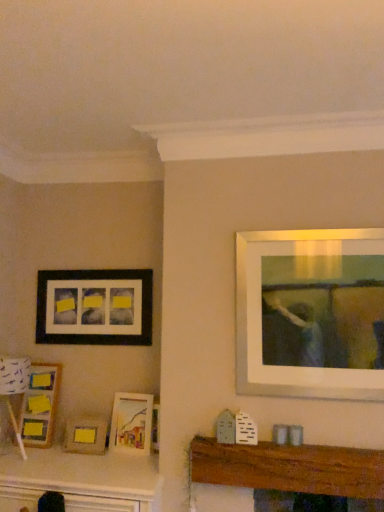
Question: From a real-world perspective, is white paper lampshade at lower left located higher than matte black picture frame at left, placed as the fourth picture frame when sorted from bottom to top?

Choices:
 (A) no
 (B) yes

Answer: (A)

Question: From the image's perspective, is white paper lampshade at lower left located beneath matte black picture frame at left, which appears as the first picture frame when viewed from the top?

Choices:
 (A) yes
 (B) no

Answer: (A)

Question: Would you say white paper lampshade at lower left is a long distance from matte black picture frame at left, placed as the fourth picture frame when sorted from bottom to top?

Choices:
 (A) no
 (B) yes

Answer: (A)

Question: Is white paper lampshade at lower left thinner than matte black picture frame at left, which appears as the first picture frame when viewed from the top?

Choices:
 (A) no
 (B) yes

Answer: (A)

Question: From a real-world perspective, does white paper lampshade at lower left sit lower than matte black picture frame at left, placed as the fourth picture frame when sorted from bottom to top?

Choices:
 (A) yes
 (B) no

Answer: (A)

Question: Considering the relative sizes of white paper lampshade at lower left and matte black picture frame at left, which appears as the first picture frame when viewed from the top, in the image provided, is white paper lampshade at lower left bigger than matte black picture frame at left, which appears as the first picture frame when viewed from the top,?

Choices:
 (A) yes
 (B) no

Answer: (A)

Question: Is the position of matte yellow picture frame at lower left, placed as the 1th picture frame when sorted from bottom to top, less distant than that of matte wooden picture frame at center, acting as the 3th picture frame starting from the top?

Choices:
 (A) yes
 (B) no

Answer: (B)

Question: Does matte yellow picture frame at lower left, placed as the 1th picture frame when sorted from bottom to top, have a smaller size compared to matte wooden picture frame at center, the 2th picture frame when ordered from bottom to top?

Choices:
 (A) no
 (B) yes

Answer: (B)

Question: Considering the relative sizes of matte yellow picture frame at lower left, the 4th picture frame positioned from the top, and matte wooden picture frame at center, the 2th picture frame when ordered from bottom to top, in the image provided, is matte yellow picture frame at lower left, the 4th picture frame positioned from the top, bigger than matte wooden picture frame at center, the 2th picture frame when ordered from bottom to top,?

Choices:
 (A) yes
 (B) no

Answer: (B)

Question: From the image's perspective, does matte yellow picture frame at lower left, the 4th picture frame positioned from the top, appear higher than matte wooden picture frame at center, acting as the 3th picture frame starting from the top?

Choices:
 (A) no
 (B) yes

Answer: (A)

Question: Is there a large distance between matte yellow picture frame at lower left, placed as the 1th picture frame when sorted from bottom to top, and matte wooden picture frame at center, the 2th picture frame when ordered from bottom to top?

Choices:
 (A) no
 (B) yes

Answer: (A)

Question: Is matte yellow picture frame at lower left, the 4th picture frame positioned from the top, shorter than matte wooden picture frame at center, acting as the 3th picture frame starting from the top?

Choices:
 (A) no
 (B) yes

Answer: (B)

Question: Are matte black picture frame at left, which appears as the first picture frame when viewed from the top, and wooden picture frame at lower left, acting as the 2th picture frame starting from the top, located far from each other?

Choices:
 (A) yes
 (B) no

Answer: (B)